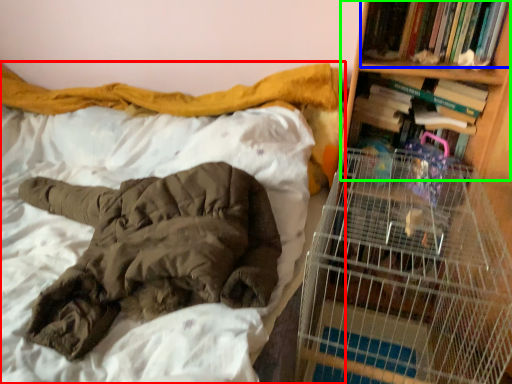
Question: Based on their relative distances, which object is farther from bed (highlighted by a red box)? Choose from book (highlighted by a blue box) and bookshelf (highlighted by a green box).

Choices:
 (A) book
 (B) bookshelf

Answer: (B)